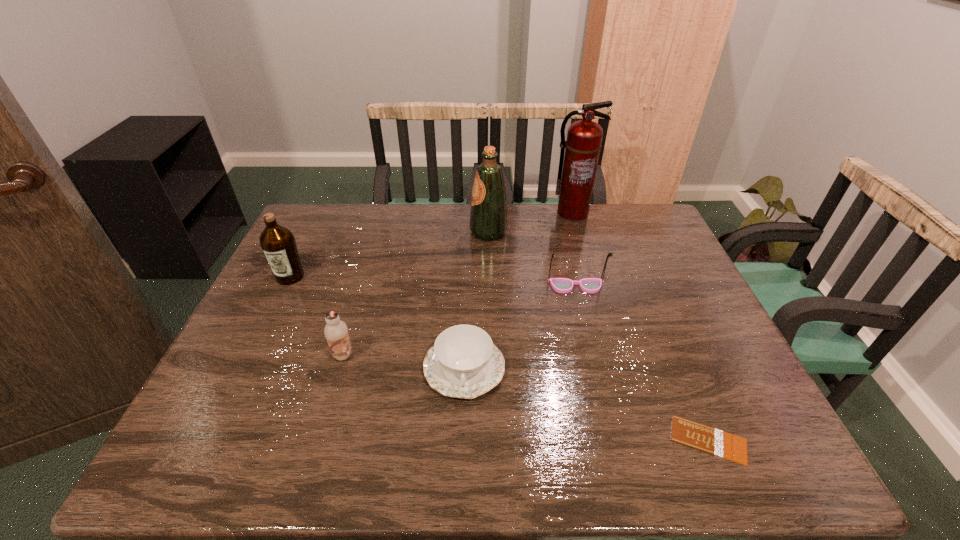
In order to click on fire extinguisher present at the far edge in this screenshot , I will do `click(582, 148)`.

Identify the location of olive oil situated at the far edge. (488, 219).

This screenshot has height=540, width=960. I want to click on object that is at the near edge, so click(708, 439).

Image resolution: width=960 pixels, height=540 pixels. Identify the location of object located at the left edge. (277, 242).

Identify the location of object that is at the right edge. (708, 439).

Find the location of a particular element. Image resolution: width=960 pixels, height=540 pixels. object at the near right corner is located at coordinates (708, 439).

The width and height of the screenshot is (960, 540). What are the coordinates of `free space at the far edge` in the screenshot? It's located at (550, 230).

In the image, there is a desktop. Find the location of `blank space at the near edge`. blank space at the near edge is located at coordinates (433, 451).

I want to click on free space at the left edge of the desktop, so click(270, 321).

The width and height of the screenshot is (960, 540). In the image, there is a desktop. What are the coordinates of `free space at the right edge` in the screenshot? It's located at (683, 285).